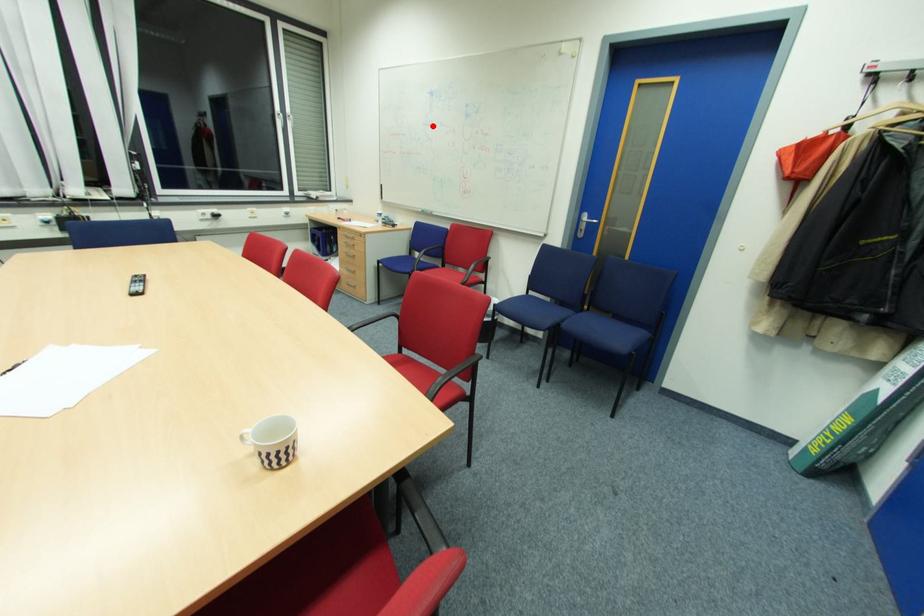
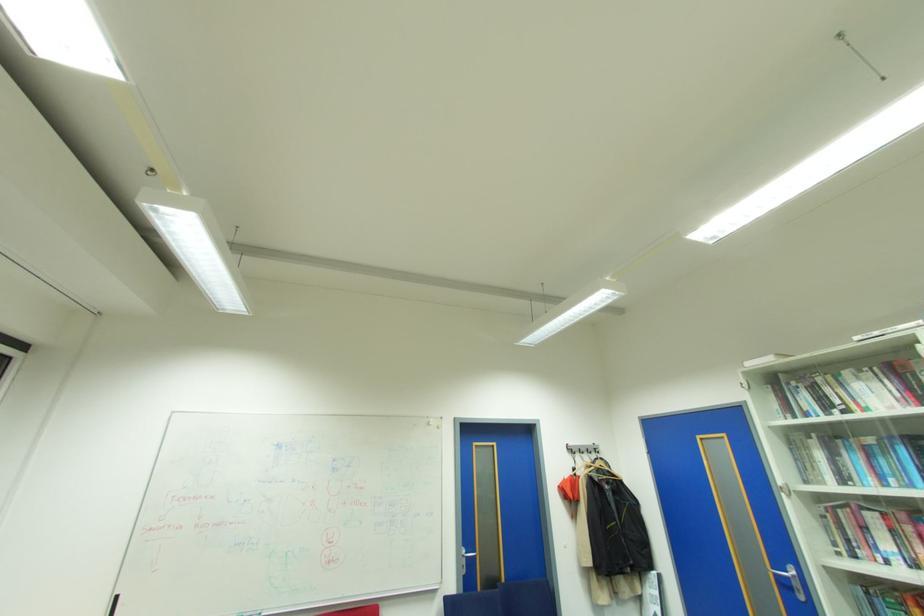
Question: I am providing you with two images of the same scene from different viewpoints. Given a red point in image1, look at the same physical point in image2. Is it:

Choices:
 (A) Closer to the viewpoint
 (B) Farther from the viewpoint

Answer: (B)